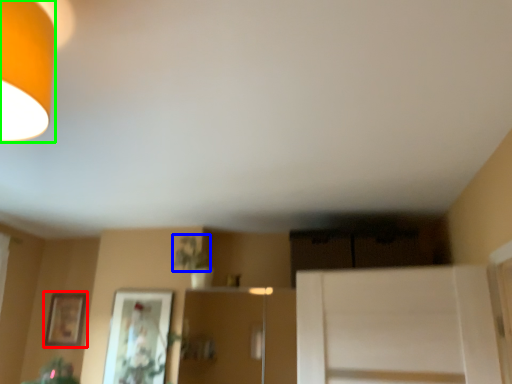
Question: Based on their relative distances, which object is nearer to picture frame (highlighted by a red box)? Choose from plant (highlighted by a blue box) and lamp (highlighted by a green box).

Choices:
 (A) plant
 (B) lamp

Answer: (A)